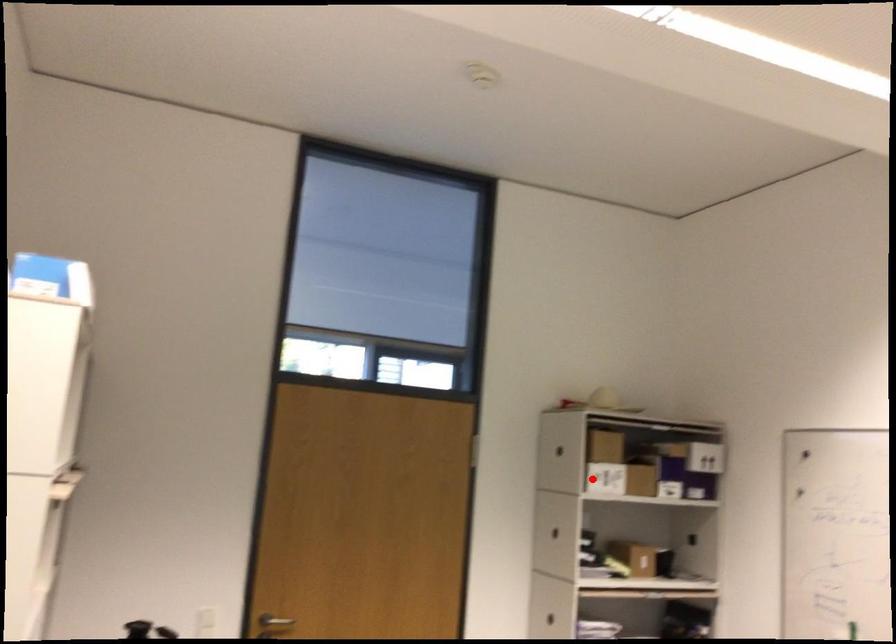
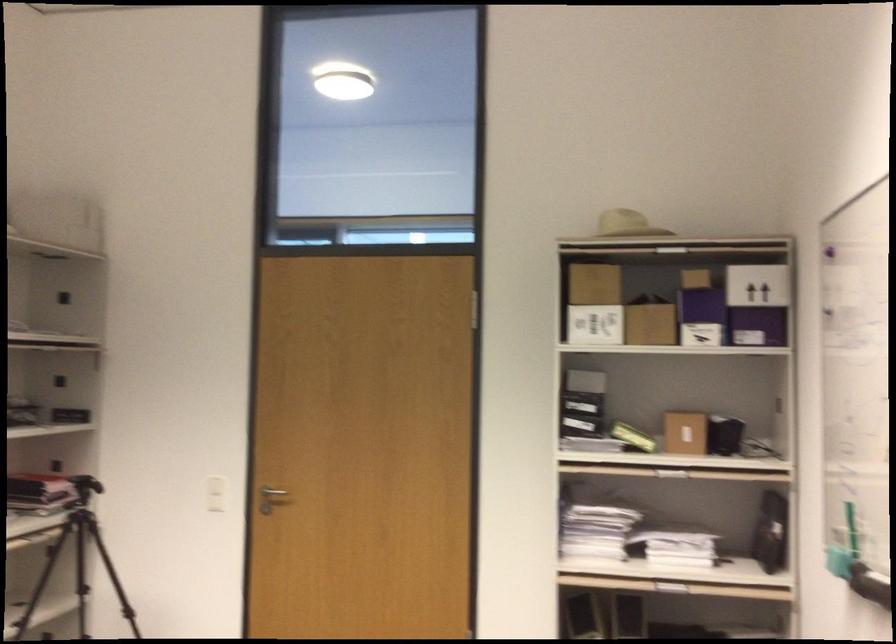
Question: I am providing you with two images of the same scene from different viewpoints. In image1, a red point is highlighted. Considering the same 3D point in image2, which of the following is correct?

Choices:
 (A) It is closer
 (B) It is farther

Answer: (A)